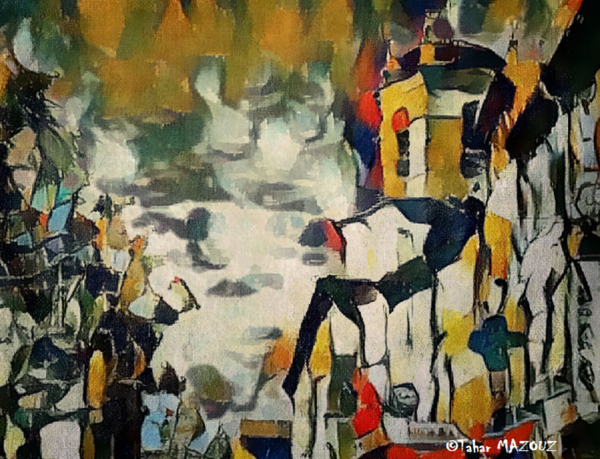
The image size is (600, 459). In order to click on abstract painting in this screenshot , I will do `click(306, 192)`.